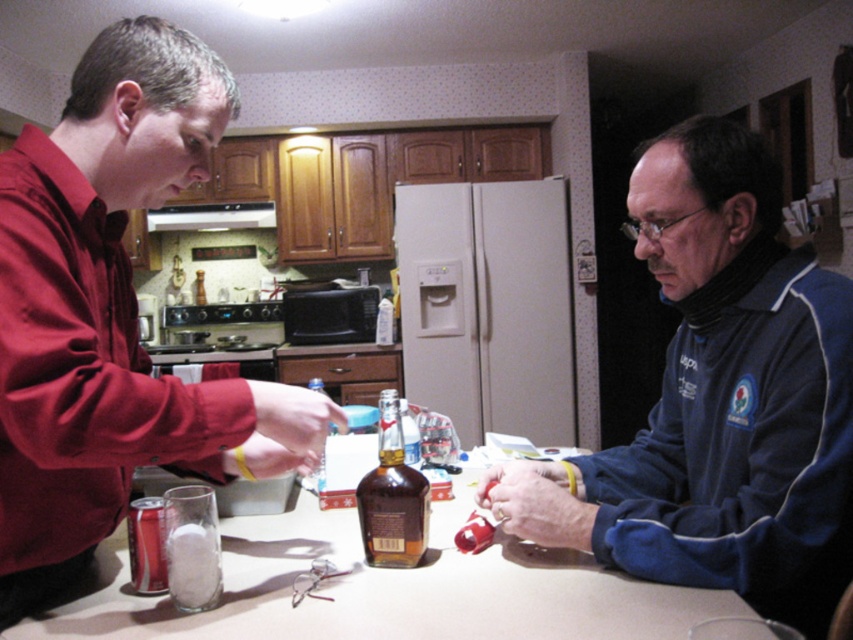
Question: Among these objects, which one is nearest to the camera?

Choices:
 (A) smooth beige table at center
 (B) brown glass bottle at center
 (C) blue fleece jacket at center

Answer: (A)

Question: Which point is farther to the camera?

Choices:
 (A) smooth beige table at center
 (B) matte red shirt at center
 (C) brown glass bottle at center

Answer: (C)

Question: Which object is positioned farthest from the brown glass bottle at center?

Choices:
 (A) blue fleece jacket at center
 (B) matte red shirt at center
 (C) smooth beige table at center

Answer: (B)

Question: Is blue fleece jacket at center to the left of matte red shirt at center from the viewer's perspective?

Choices:
 (A) no
 (B) yes

Answer: (A)

Question: Is blue fleece jacket at center closer to camera compared to matte red shirt at center?

Choices:
 (A) no
 (B) yes

Answer: (A)

Question: Does blue fleece jacket at center have a greater width compared to matte red shirt at center?

Choices:
 (A) yes
 (B) no

Answer: (A)